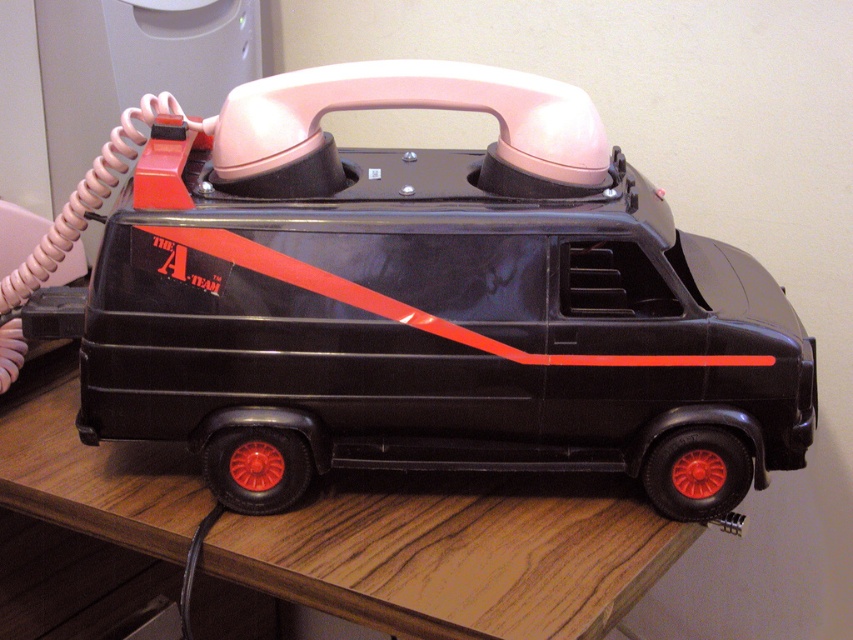
Does black plastic van at center appear over wooden table at lower center?

Yes.

Can you confirm if black plastic van at center is positioned below wooden table at lower center?

Actually, black plastic van at center is above wooden table at lower center.

Is point (260, 250) closer to viewer compared to point (415, 493)?

Yes, point (260, 250) is in front of point (415, 493).

The width and height of the screenshot is (853, 640). In order to click on black plastic van at center in this screenshot , I will do `click(428, 301)`.